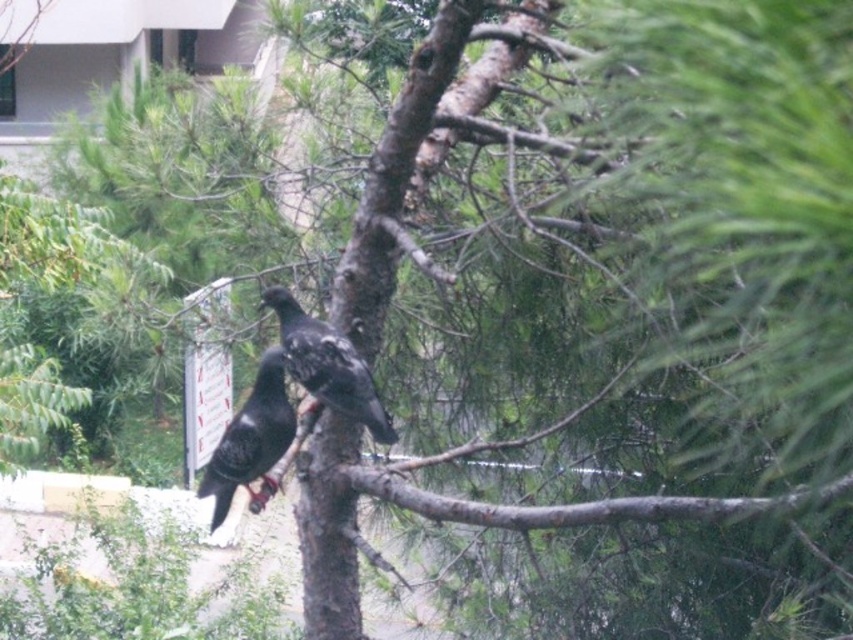
Question: Is shiny black pigeon at center to the right of shiny black bird at center from the viewer's perspective?

Choices:
 (A) no
 (B) yes

Answer: (A)

Question: Among these objects, which one is nearest to the camera?

Choices:
 (A) shiny black bird at center
 (B) brown rough tree branch at center
 (C) shiny black pigeon at center

Answer: (B)

Question: Which object is closer to the camera taking this photo?

Choices:
 (A) brown rough tree branch at center
 (B) shiny black bird at center

Answer: (A)

Question: Observing the image, what is the correct spatial positioning of brown rough tree branch at center in reference to shiny black bird at center?

Choices:
 (A) left
 (B) right

Answer: (B)

Question: Can you confirm if brown rough tree branch at center is positioned to the right of shiny black bird at center?

Choices:
 (A) no
 (B) yes

Answer: (B)

Question: Estimate the real-world distances between objects in this image. Which object is closer to the shiny black pigeon at center?

Choices:
 (A) shiny black bird at center
 (B) brown rough tree branch at center

Answer: (A)